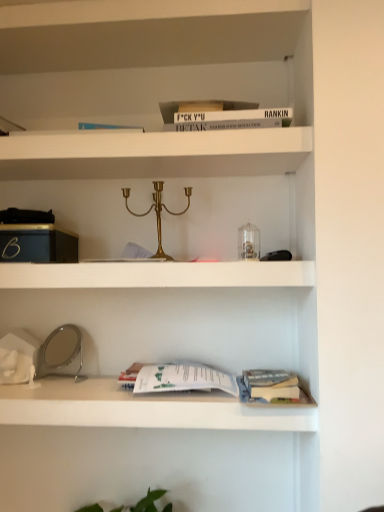
Question: Does white matte shelf at center have a greater height compared to white matte shelf at upper center, placed as the 1th shelf when sorted from top to bottom?

Choices:
 (A) no
 (B) yes

Answer: (B)

Question: From the image's perspective, is white matte shelf at center under white matte shelf at upper center, which is the second shelf in bottom-to-top order?

Choices:
 (A) no
 (B) yes

Answer: (B)

Question: Is white matte shelf at center smaller than white matte shelf at upper center, which is the second shelf in bottom-to-top order?

Choices:
 (A) no
 (B) yes

Answer: (A)

Question: Can you confirm if white matte shelf at center is positioned to the left of white matte shelf at upper center, placed as the 1th shelf when sorted from top to bottom?

Choices:
 (A) no
 (B) yes

Answer: (A)

Question: Is white matte shelf at upper center, which is the second shelf in bottom-to-top order, located within white matte shelf at center?

Choices:
 (A) no
 (B) yes

Answer: (A)

Question: Is white paper at lower center, which is counted as the first shelf, starting from the bottom, inside or outside of white matte shelf at center?

Choices:
 (A) inside
 (B) outside

Answer: (B)

Question: Looking at their shapes, would you say white paper at lower center, which is counted as the first shelf, starting from the bottom, is wider or thinner than white matte shelf at center?

Choices:
 (A) wide
 (B) thin

Answer: (B)

Question: Relative to white matte shelf at center, is white paper at lower center, which is counted as the first shelf, starting from the bottom, in front or behind?

Choices:
 (A) front
 (B) behind

Answer: (A)

Question: From the image's perspective, is white paper at lower center, positioned as the second shelf in top-to-bottom order, positioned above or below white matte shelf at center?

Choices:
 (A) below
 (B) above

Answer: (A)

Question: Is white matte shelf at upper center, which is the second shelf in bottom-to-top order, in front of or behind white matte shelf at center in the image?

Choices:
 (A) behind
 (B) front

Answer: (A)

Question: Is white matte shelf at upper center, placed as the 1th shelf when sorted from top to bottom, spatially inside white matte shelf at center, or outside of it?

Choices:
 (A) inside
 (B) outside

Answer: (B)

Question: From the image's perspective, relative to white matte shelf at center, is white matte shelf at upper center, placed as the 1th shelf when sorted from top to bottom, above or below?

Choices:
 (A) above
 (B) below

Answer: (A)

Question: From a real-world perspective, is white matte shelf at upper center, which is the second shelf in bottom-to-top order, above or below white matte shelf at center?

Choices:
 (A) below
 (B) above

Answer: (B)

Question: Considering the relative positions of white paper at lower center, positioned as the second shelf in top-to-bottom order, and white matte shelf at upper center, which is the second shelf in bottom-to-top order, in the image provided, is white paper at lower center, positioned as the second shelf in top-to-bottom order, to the left or to the right of white matte shelf at upper center, which is the second shelf in bottom-to-top order,?

Choices:
 (A) left
 (B) right

Answer: (B)

Question: Is white paper at lower center, which is counted as the first shelf, starting from the bottom, taller or shorter than white matte shelf at upper center, which is the second shelf in bottom-to-top order?

Choices:
 (A) short
 (B) tall

Answer: (B)